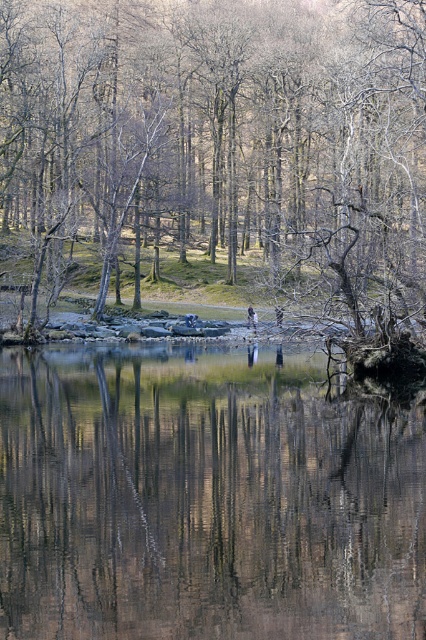
You are standing at the edge of the water and want to reach the brown matte tree at center without getting wet. The transparent water at center is in between you and the tree. Can you walk directly to the tree without stepping into the water?

The distance between the brown matte tree at center and transparent water at center is 19.05 meters, so you can walk directly to the tree without stepping into the water since the water is 19.05 meters away from the tree.

Based on the coordinates provided in the scene description, where is the brown matte tree at center located?

The brown matte tree at center is located at point (215,154).